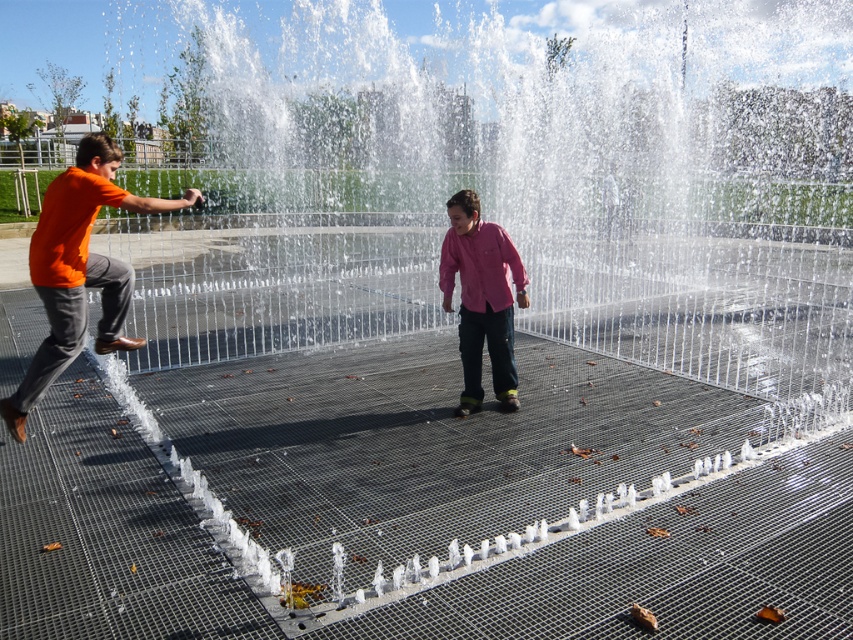
Question: From the image, what is the correct spatial relationship of orange matte shirt at left in relation to pink matte shirt at center?

Choices:
 (A) above
 (B) below

Answer: (B)

Question: Among these points, which one is farthest from the camera?

Choices:
 (A) (107, 332)
 (B) (498, 240)

Answer: (B)

Question: Which object appears closest to the camera in this image?

Choices:
 (A) orange matte shirt at left
 (B) pink matte shirt at center

Answer: (A)

Question: Can you confirm if orange matte shirt at left is thinner than pink matte shirt at center?

Choices:
 (A) yes
 (B) no

Answer: (B)

Question: Does orange matte shirt at left have a larger size compared to pink matte shirt at center?

Choices:
 (A) no
 (B) yes

Answer: (B)